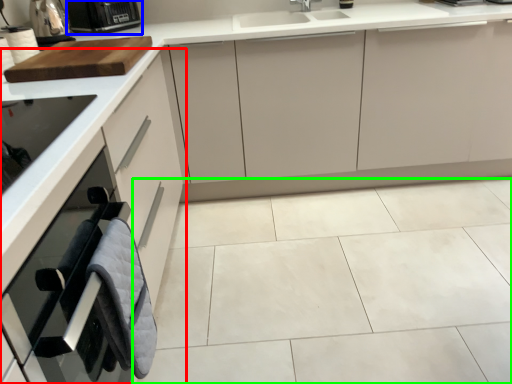
Question: Which object is the closest to the cabinetry (highlighted by a red box)? Choose among these: kitchen appliance (highlighted by a blue box) or ceramic tile (highlighted by a green box).

Choices:
 (A) kitchen appliance
 (B) ceramic tile

Answer: (B)